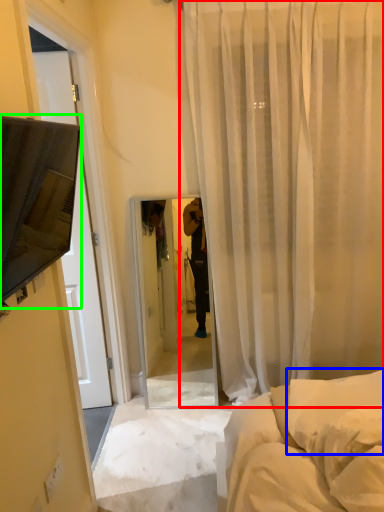
Question: Which is farther away from curtain (highlighted by a red box)? pillow (highlighted by a blue box) or canopy bed (highlighted by a green box)?

Choices:
 (A) pillow
 (B) canopy bed

Answer: (B)